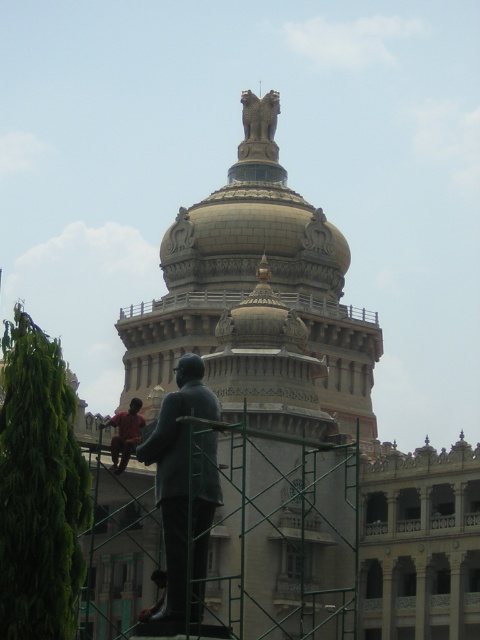
Which of these two, bronze statue at upper center or red shirt at lower left, stands taller?

red shirt at lower left is taller.

Who is more forward, (268, 109) or (123, 429)?

Point (123, 429) is more forward.

In order to click on bronze statue at upper center in this screenshot , I will do `click(259, 125)`.

Who is lower down, bronze statue at lower left or red shirt at lower left?

bronze statue at lower left

Locate an element on the screen. The height and width of the screenshot is (640, 480). bronze statue at lower left is located at coordinates (177, 474).

This screenshot has width=480, height=640. Describe the element at coordinates (177, 474) in the screenshot. I see `bronze statue at lower left` at that location.

The width and height of the screenshot is (480, 640). I want to click on bronze statue at lower left, so click(177, 474).

Does bronze statue at lower left appear on the left side of bronze statue at upper center?

Indeed, bronze statue at lower left is positioned on the left side of bronze statue at upper center.

Who is more forward, (203, 499) or (264, 99)?

Positioned in front is point (203, 499).

At what (x,y) coordinates should I click in order to perform the action: click on bronze statue at lower left. Please return your answer as a coordinate pair (x, y). Looking at the image, I should click on (177, 474).